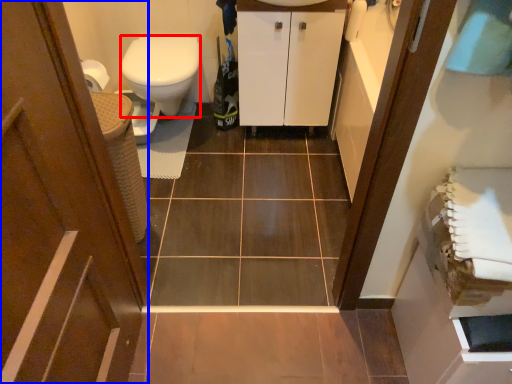
Question: Which of the following is the farthest to the observer, bidet (highlighted by a red box) or door (highlighted by a blue box)?

Choices:
 (A) bidet
 (B) door

Answer: (A)